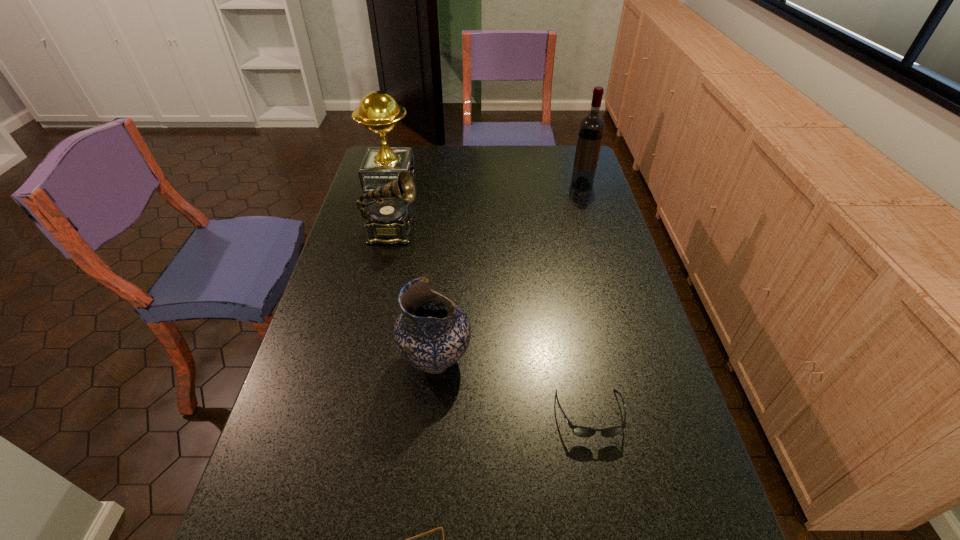
Locate an element on the screen. Image resolution: width=960 pixels, height=540 pixels. the rightmost object is located at coordinates (591, 130).

Find the location of a particular element. The height and width of the screenshot is (540, 960). award is located at coordinates (378, 111).

Locate an element on the screen. phonograph record is located at coordinates (389, 221).

Image resolution: width=960 pixels, height=540 pixels. Identify the location of pottery. (432, 333).

Where is `the second shortest object`? the second shortest object is located at coordinates click(x=579, y=431).

Locate an element on the screen. The width and height of the screenshot is (960, 540). the right sunglasses is located at coordinates (579, 431).

The height and width of the screenshot is (540, 960). I want to click on free point located on the left of the wine bottle, so click(x=486, y=185).

Locate an element on the screen. This screenshot has width=960, height=540. vacant space situated 0.200m on the front-facing side of the award is located at coordinates (465, 181).

The image size is (960, 540). Find the location of `vacant space situated 0.060m on the horn of the phonograph record`. vacant space situated 0.060m on the horn of the phonograph record is located at coordinates (439, 233).

I want to click on vacant space situated 0.350m on the right of the pottery, so click(609, 359).